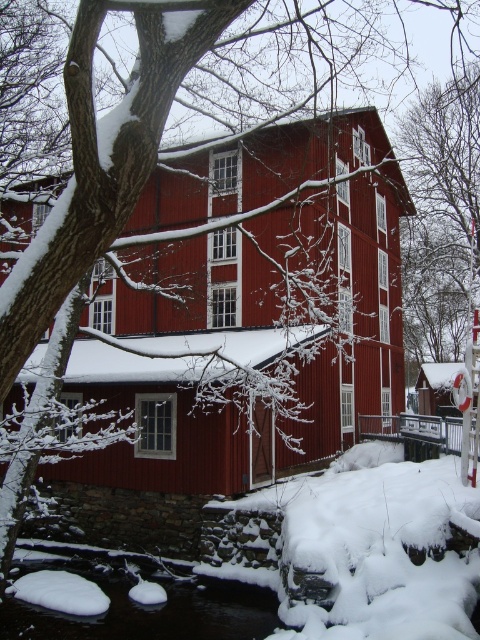
You are standing at the origin point in the winter scene. The coordinates of the matte red barn at center are given as point (x=313, y=250). If you want to walk directly towards the barn, in which general direction should you move?

The matte red barn at center is located at point (x=313, y=250), so you should move towards the center of the image to reach it.

You are a photographer standing in the snowy landscape. You want to take a photo of both the matte red barn at center and the black ice at lower center. Which object should you focus on first to ensure both are in sharp focus?

You should focus on the matte red barn at center first because it is closer to the viewer than the black ice at lower center. By focusing on the closer object, the background object will still be in acceptable focus due to the depth of field, ensuring both are sharp.

You are an architect designing a new winter village and want to place the matte red barn at center and the black ice at lower center in your design. Which object should you allocate more space to in your blueprint?

The matte red barn at center has a larger size compared to black ice at lower center, so you should allocate more space to the matte red barn at center in your blueprint.